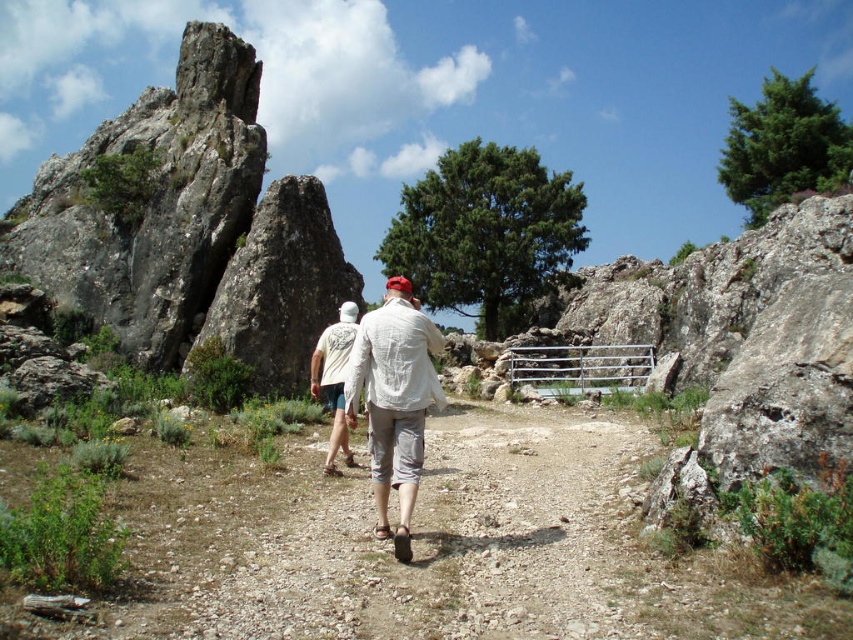
Which of these two, white linen shirt at center or white cotton shirt at center, stands shorter?

white cotton shirt at center is shorter.

Is white linen shirt at center above white cotton shirt at center?

No.

Between point (378, 374) and point (329, 337), which one is positioned behind?

The point (329, 337) is more distant.

Identify the location of white linen shirt at center. (393, 400).

Does rough gray rock formation at left have a greater width compared to white cotton shirt at center?

Correct, the width of rough gray rock formation at left exceeds that of white cotton shirt at center.

Does rough gray rock formation at left come behind white cotton shirt at center?

Yes, it is.

Does point (138, 339) lie behind point (332, 339)?

That is True.

The height and width of the screenshot is (640, 853). I want to click on rough gray rock formation at left, so click(x=193, y=228).

Is rough gray rock formation at left closer to the viewer compared to white linen shirt at center?

No.

Can you confirm if rough gray rock formation at left is positioned below white linen shirt at center?

No, rough gray rock formation at left is not below white linen shirt at center.

Identify the location of rough gray rock formation at left. (193, 228).